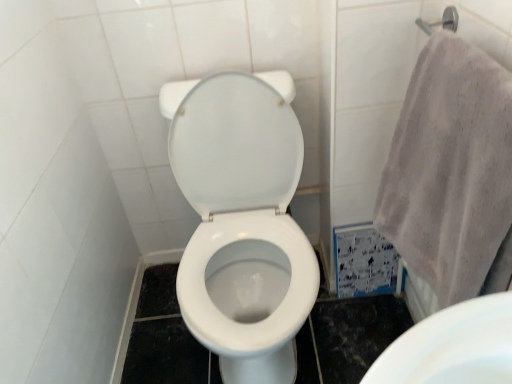
Question: Is point (200, 87) closer or farther from the camera than point (396, 173)?

Choices:
 (A) farther
 (B) closer

Answer: (A)

Question: Based on their sizes in the image, would you say white glossy toilet at center is bigger or smaller than gray cotton towel at right?

Choices:
 (A) small
 (B) big

Answer: (B)

Question: From the image's perspective, is white glossy toilet at center located above or below gray cotton towel at right?

Choices:
 (A) below
 (B) above

Answer: (A)

Question: Is gray cotton towel at right situated inside white glossy toilet at center or outside?

Choices:
 (A) inside
 (B) outside

Answer: (B)

Question: Is gray cotton towel at right taller or shorter than white glossy toilet at center?

Choices:
 (A) tall
 (B) short

Answer: (B)

Question: In the image, is gray cotton towel at right on the left side or the right side of white glossy toilet at center?

Choices:
 (A) right
 (B) left

Answer: (A)

Question: In the image, is gray cotton towel at right positioned in front of or behind white glossy toilet at center?

Choices:
 (A) behind
 (B) front

Answer: (B)